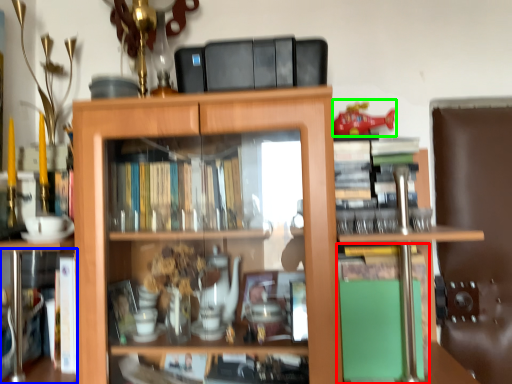
Question: Based on their relative distances, which object is farther from book (highlighted by a red box)? Choose from book (highlighted by a blue box) and toy (highlighted by a green box).

Choices:
 (A) book
 (B) toy

Answer: (A)